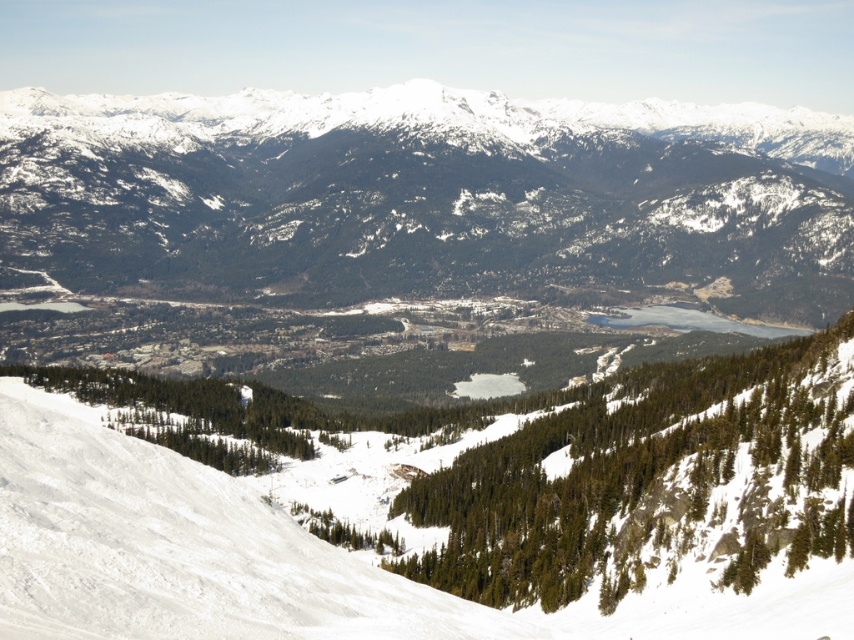
You are a hiker planning to descend from the snowy forested mountain at center to the white snow ski slope at lower left. Based on the scene, which direction should you head to reach the ski slope?

The snowy forested mountain at center is positioned over the white snow ski slope at lower left, so you should head downward towards the lower left direction to reach the ski slope.

You are planning to take a photo of both the snowy forested mountain at center and the white snow ski slope at lower left. Since you want both objects to appear equally prominent in the photo, which one should you zoom in on more?

The snowy forested mountain at center is larger in size than the white snow ski slope at lower left, so you should zoom in more on the white snow ski slope at lower left to make both appear equally prominent in the photo.